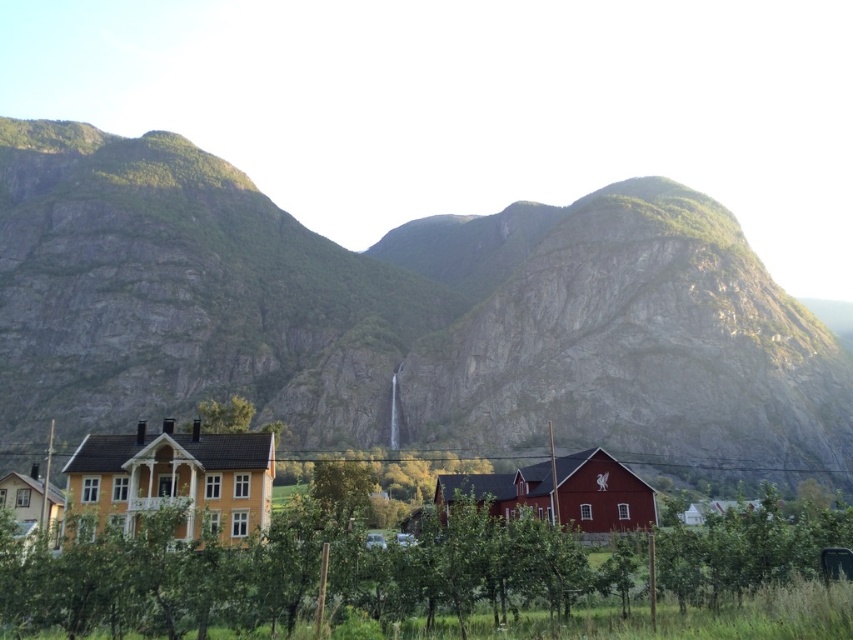
What does the point at coordinates (401, 316) represent in the image?

The point at coordinates (401, 316) corresponds to the rough stone mountain at center.

You are planning to build a hiking trail between the rough stone mountain at center and the green leafy tree at center. Considering their widths, which one will require a wider path to accommodate its size?

The rough stone mountain at center has a larger width than the green leafy tree at center, so the path should be wider to accommodate the rough stone mountain at center.

You are standing in the middle of the rural landscape and want to take a photo of both the rough stone mountain at center and the green leafy tree at center. Which object should you focus on first to ensure it is in sharp focus?

You should focus on the rough stone mountain at center first because it is closer to you than the green leafy tree at center, so it will be in focus before the tree.